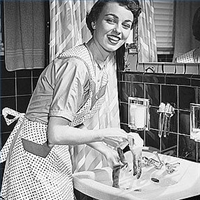
Where is `towel hanging in background`? towel hanging in background is located at coordinates (28, 28).